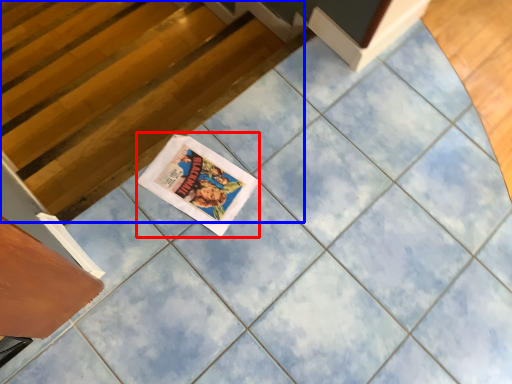
Question: Which point is closer to the camera, comic book (highlighted by a red box) or stairwell (highlighted by a blue box)?

Choices:
 (A) comic book
 (B) stairwell

Answer: (A)